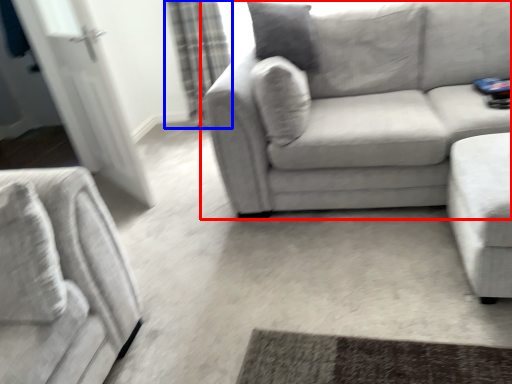
Question: Among these objects, which one is nearest to the camera, studio couch (highlighted by a red box) or curtain (highlighted by a blue box)?

Choices:
 (A) studio couch
 (B) curtain

Answer: (A)